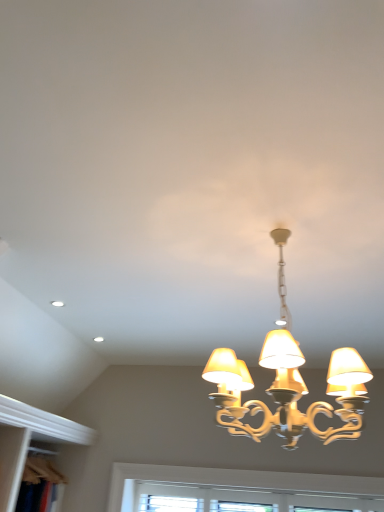
At what (x,y) coordinates should I click in order to perform the action: click on white textured window at lower center. Please return your answer as a coordinate pair (x, y). Image resolution: width=384 pixels, height=512 pixels. Looking at the image, I should click on (240, 498).

At what (x,y) coordinates should I click in order to perform the action: click on wooden bookshelf at lower left. Please return your answer as a coordinate pair (x, y). Looking at the image, I should click on (39, 485).

At what (x,y) coordinates should I click in order to perform the action: click on gold metallic chandelier at center. Please return your answer as a coordinate pair (x, y). The height and width of the screenshot is (512, 384). Looking at the image, I should click on (289, 383).

Identify the location of white textured window at lower center. Image resolution: width=384 pixels, height=512 pixels. (240, 498).

How many degrees apart are the facing directions of wooden bookshelf at lower left and gold metallic chandelier at center?

The angle between the facing direction of wooden bookshelf at lower left and the facing direction of gold metallic chandelier at center is 84 degrees.

From the image's perspective, would you say wooden bookshelf at lower left is positioned over gold metallic chandelier at center?

No, from the image's perspective, wooden bookshelf at lower left is not above gold metallic chandelier at center.

Who is shorter, wooden bookshelf at lower left or gold metallic chandelier at center?

With less height is wooden bookshelf at lower left.

Between gold metallic chandelier at center and white textured window at lower center, which one appears on the left side from the viewer's perspective?

gold metallic chandelier at center.

From a real-world perspective, is gold metallic chandelier at center on top of white textured window at lower center?

Yes, from a real-world perspective, gold metallic chandelier at center is on top of white textured window at lower center.

Is point (336, 371) closer or farther from the camera than point (296, 493)?

Clearly, point (336, 371) is closer to the camera than point (296, 493).

Can you confirm if gold metallic chandelier at center is thinner than white textured window at lower center?

In fact, gold metallic chandelier at center might be wider than white textured window at lower center.

Which of these two, wooden bookshelf at lower left or white textured window at lower center, is thinner?

Thinner between the two is white textured window at lower center.

Is wooden bookshelf at lower left facing towards white textured window at lower center?

Yes, wooden bookshelf at lower left is oriented towards white textured window at lower center.

Can you tell me how much wooden bookshelf at lower left and white textured window at lower center differ in facing direction?

wooden bookshelf at lower left and white textured window at lower center are facing 90.2 degrees away from each other.

From a real-world perspective, is wooden bookshelf at lower left positioned above or below white textured window at lower center?

From a real-world perspective, wooden bookshelf at lower left is physically above white textured window at lower center.

In the scene shown: Which object is further away from the camera, white textured window at lower center or wooden bookshelf at lower left?

white textured window at lower center.

In the scene shown: Is white textured window at lower center wider than wooden bookshelf at lower left?

No, white textured window at lower center is not wider than wooden bookshelf at lower left.

How far apart are white textured window at lower center and wooden bookshelf at lower left?

A distance of 3.73 feet exists between white textured window at lower center and wooden bookshelf at lower left.

Is white textured window at lower center at the right side of wooden bookshelf at lower left?

Indeed, white textured window at lower center is positioned on the right side of wooden bookshelf at lower left.

Considering the relative positions of white textured window at lower center and gold metallic chandelier at center in the image provided, is white textured window at lower center in front of gold metallic chandelier at center?

No, white textured window at lower center is further to the viewer.

Image resolution: width=384 pixels, height=512 pixels. I want to click on window lying below the gold metallic chandelier at center (from the image's perspective), so click(x=240, y=498).

From the image's perspective, is white textured window at lower center on top of gold metallic chandelier at center?

No, from the image's perspective, white textured window at lower center is not on top of gold metallic chandelier at center.

From a real-world perspective, is white textured window at lower center above or below gold metallic chandelier at center?

Clearly, from a real-world perspective, white textured window at lower center is below gold metallic chandelier at center.

From the image's perspective, relative to wooden bookshelf at lower left, is gold metallic chandelier at center above or below?

Based on their image positions, gold metallic chandelier at center is located above wooden bookshelf at lower left.

Does gold metallic chandelier at center contain wooden bookshelf at lower left?

No, wooden bookshelf at lower left is not a part of gold metallic chandelier at center.

Which object is more forward, gold metallic chandelier at center or wooden bookshelf at lower left?

gold metallic chandelier at center.

Is gold metallic chandelier at center wider or thinner than wooden bookshelf at lower left?

Considering their sizes, gold metallic chandelier at center looks broader than wooden bookshelf at lower left.

The height and width of the screenshot is (512, 384). What are the coordinates of `lamp located above the wooden bookshelf at lower left (from the image's perspective)` in the screenshot? It's located at tap(289, 383).

Where is `lamp above the white textured window at lower center (from a real-world perspective)`? The width and height of the screenshot is (384, 512). lamp above the white textured window at lower center (from a real-world perspective) is located at coordinates (289, 383).

Based on the photo, which object lies further to the anchor point gold metallic chandelier at center, wooden bookshelf at lower left or white textured window at lower center?

The object further to gold metallic chandelier at center is wooden bookshelf at lower left.

Which object lies nearer to the anchor point white textured window at lower center, gold metallic chandelier at center or wooden bookshelf at lower left?

Among the two, gold metallic chandelier at center is located nearer to white textured window at lower center.

Considering their positions, is gold metallic chandelier at center positioned further to wooden bookshelf at lower left than white textured window at lower center?

Based on the image, gold metallic chandelier at center appears to be further to wooden bookshelf at lower left.

Based on the photo, based on their spatial positions, is white textured window at lower center or wooden bookshelf at lower left further from gold metallic chandelier at center?

Among the two, wooden bookshelf at lower left is located further to gold metallic chandelier at center.

When comparing their distances from white textured window at lower center, does wooden bookshelf at lower left or gold metallic chandelier at center seem closer?

gold metallic chandelier at center is closer to white textured window at lower center.

When comparing their distances from wooden bookshelf at lower left, does white textured window at lower center or gold metallic chandelier at center seem further?

gold metallic chandelier at center lies further to wooden bookshelf at lower left than the other object.

What are the coordinates of `bookshelf between gold metallic chandelier at center and white textured window at lower center in the front-back direction` in the screenshot? It's located at (39, 485).